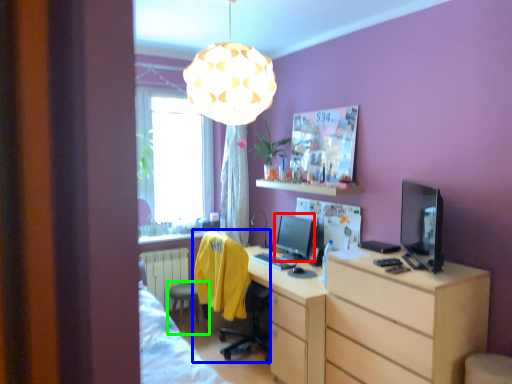
Question: Which object is the closest to the computer monitor (highlighted by a red box)? Choose among these: swivel chair (highlighted by a blue box) or stool (highlighted by a green box).

Choices:
 (A) swivel chair
 (B) stool

Answer: (A)